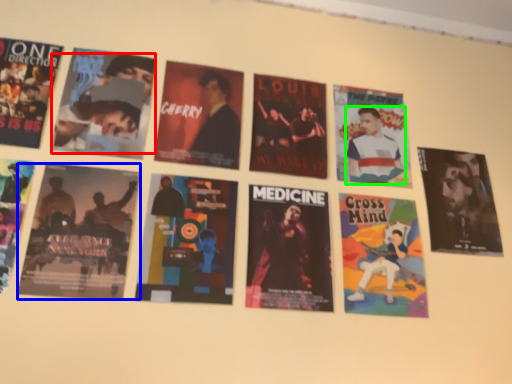
Question: Based on their relative distances, which object is nearer to person (highlighted by a red box)? Choose from poster (highlighted by a blue box) and person (highlighted by a green box).

Choices:
 (A) poster
 (B) person

Answer: (A)